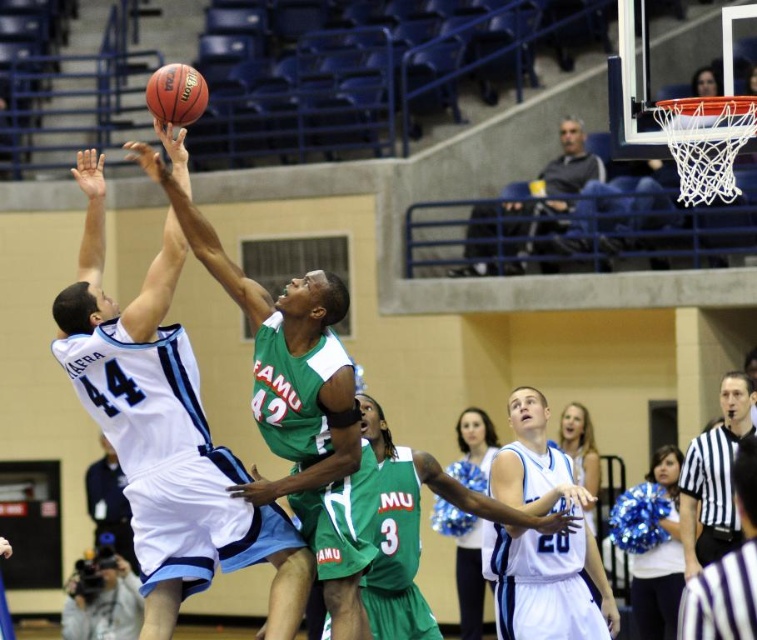
Question: Is black and white striped shirt at lower right to the left of gray fabric camera at lower left from the viewer's perspective?

Choices:
 (A) no
 (B) yes

Answer: (A)

Question: Considering the relative positions of gray fabric camera at lower left and white jersey at center in the image provided, where is gray fabric camera at lower left located with respect to white jersey at center?

Choices:
 (A) left
 (B) right

Answer: (B)

Question: Which of the following is the closest to the observer?

Choices:
 (A) (176, 124)
 (B) (154, 614)
 (C) (136, 625)

Answer: (A)

Question: Estimate the real-world distances between objects in this image. Which object is closer to the green matte basketball player at center?

Choices:
 (A) white jersey at center
 (B) black and white striped shirt at lower right
 (C) dark gray sweater at upper center

Answer: (B)

Question: Is green matte basketball player at center positioned at the back of dark gray sweater at upper center?

Choices:
 (A) no
 (B) yes

Answer: (A)

Question: Based on their relative distances, which object is nearer to the dark gray sweater at upper center?

Choices:
 (A) black and white striped shirt at lower right
 (B) white jersey at center

Answer: (A)